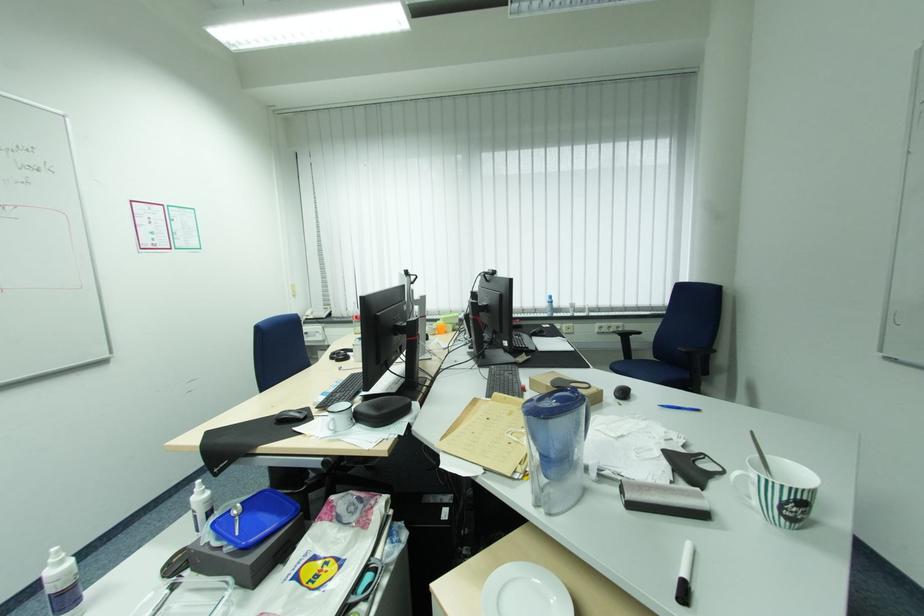
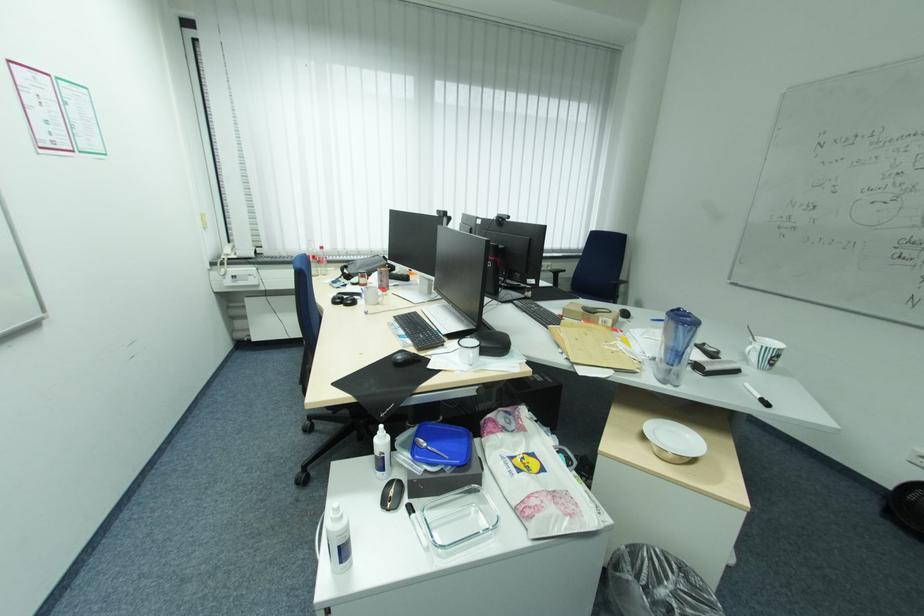
Find the pixel in the second image that matches (286,418) in the first image.

(406, 361)